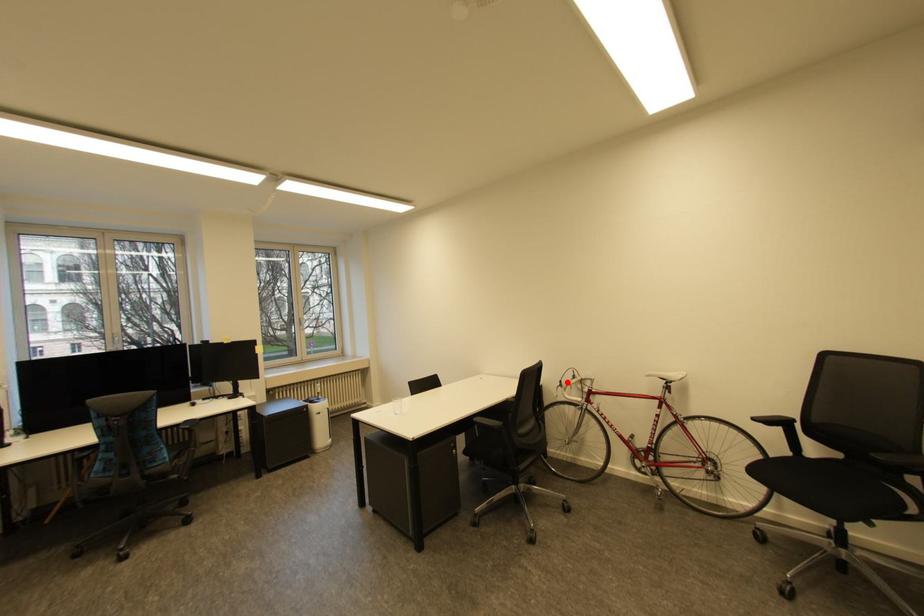
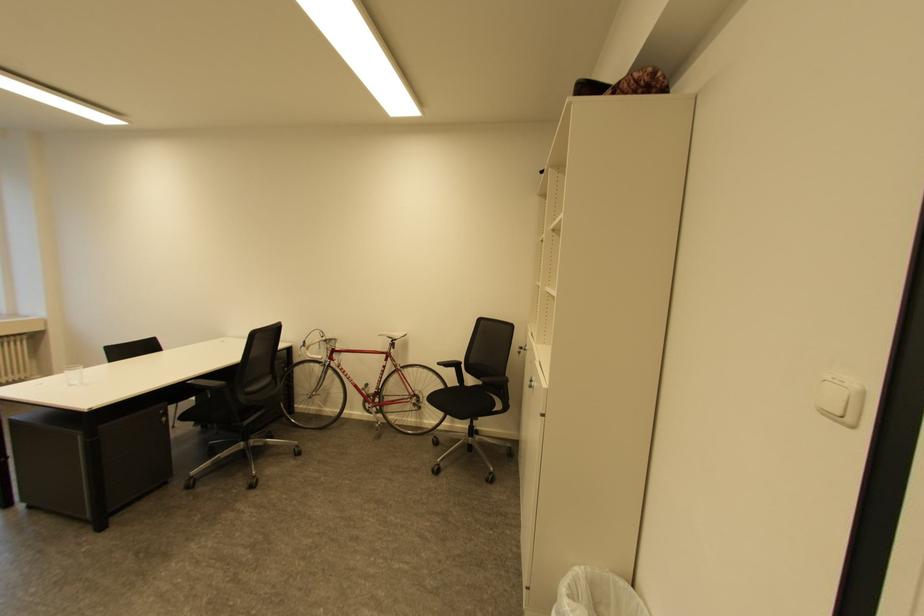
Find the pixel in the second image that matches the highlighted location in the first image.

(311, 342)